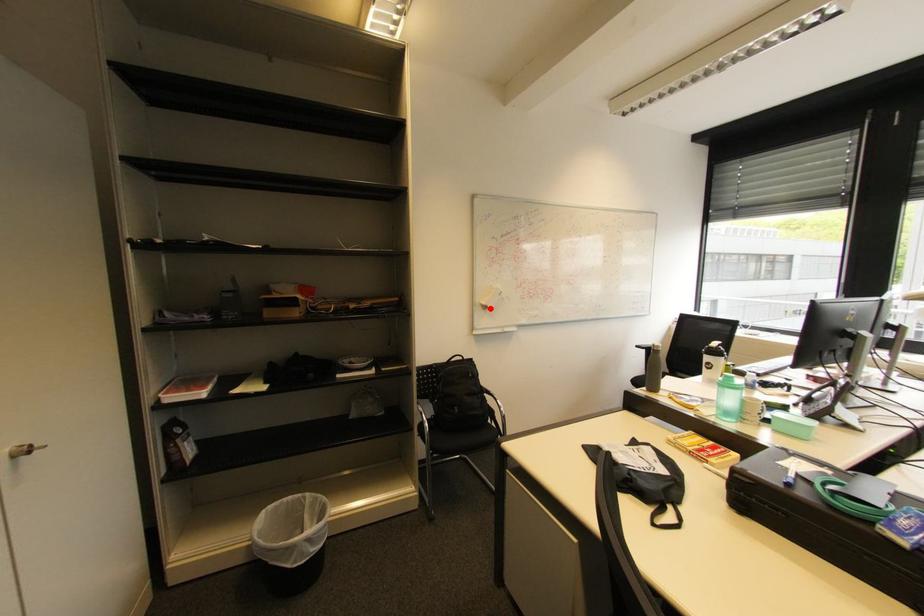
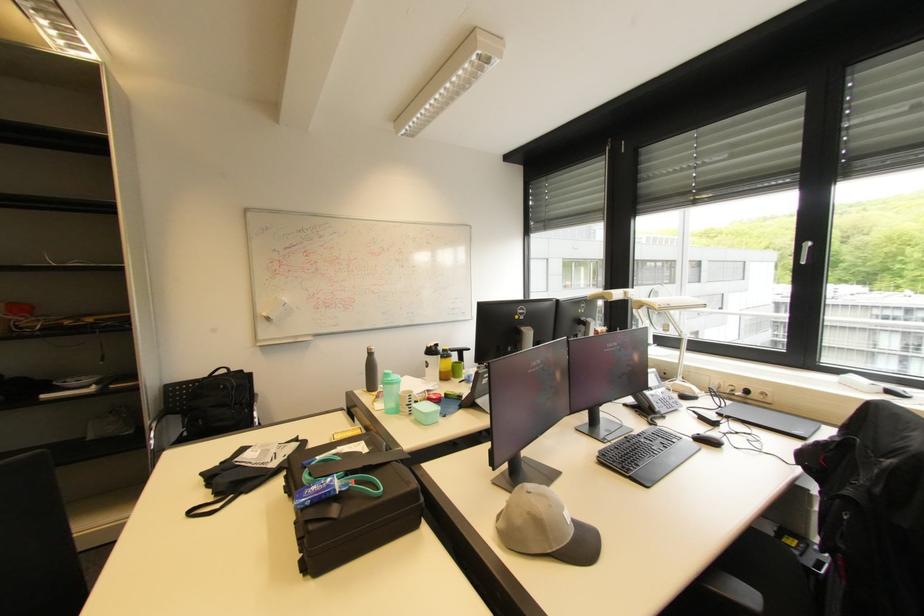
Locate, in the second image, the point that corresponds to the highlighted location in the first image.

(273, 320)